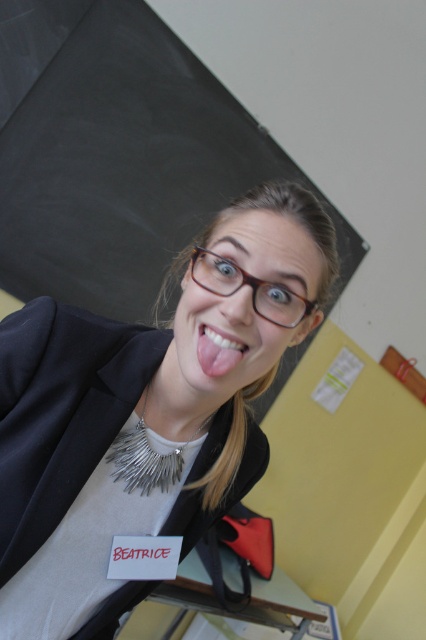
Question: Which of the following is the closest to the observer?

Choices:
 (A) (227, 337)
 (B) (230, 276)
 (C) (166, 508)
 (D) (48, 140)

Answer: (A)

Question: Does matte black blazer at center appear under glossy white teeth at center?

Choices:
 (A) no
 (B) yes

Answer: (B)

Question: Can you confirm if matte black blazer at center is smaller than glossy white teeth at center?

Choices:
 (A) yes
 (B) no

Answer: (B)

Question: Is yellow matte bulletin board at upper center positioned at the back of brown matte glasses at center?

Choices:
 (A) yes
 (B) no

Answer: (A)

Question: Which point is farther to the camera?

Choices:
 (A) (207, 374)
 (B) (250, 278)
 (C) (314, 288)

Answer: (C)

Question: Which of the following is the farthest from the observer?

Choices:
 (A) (190, 269)
 (B) (279, 385)
 (C) (282, 314)
 (D) (236, 356)

Answer: (B)